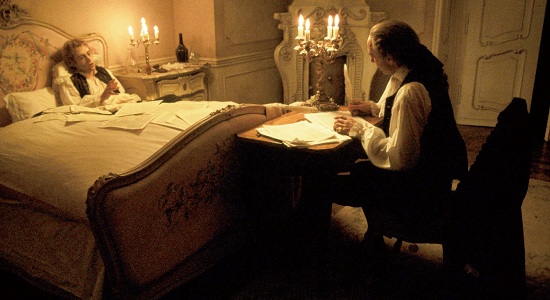
Image resolution: width=550 pixels, height=300 pixels. Find the location of `blankets`. blankets is located at coordinates (86, 162), (70, 248).